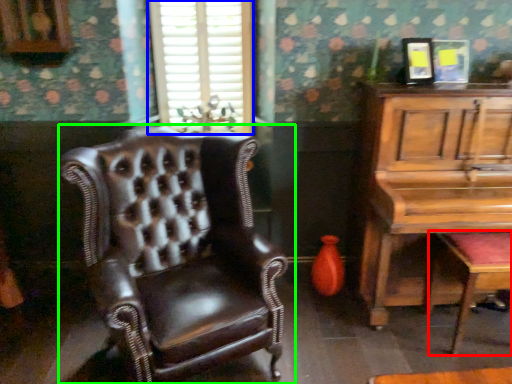
Question: Considering the real-world distances, which object is closest to music stool (highlighted by a red box)? window (highlighted by a blue box) or chair (highlighted by a green box).

Choices:
 (A) window
 (B) chair

Answer: (B)